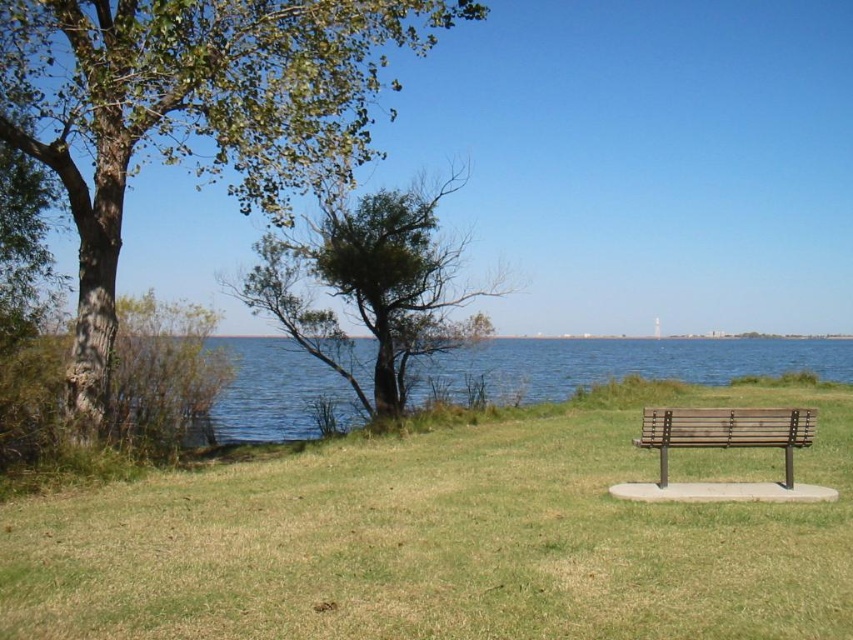
Is green grass at center shorter than green leafy tree at left?

Yes, green grass at center is shorter than green leafy tree at left.

Is green grass at center smaller than green leafy tree at left?

Indeed, green grass at center has a smaller size compared to green leafy tree at left.

The image size is (853, 640). Describe the element at coordinates (440, 541) in the screenshot. I see `green grass at center` at that location.

The image size is (853, 640). Identify the location of green grass at center. (440, 541).

Describe the element at coordinates (440, 541) in the screenshot. This screenshot has height=640, width=853. I see `green grass at center` at that location.

Is green grass at center to the left of green leafy tree at center from the viewer's perspective?

In fact, green grass at center is to the right of green leafy tree at center.

This screenshot has height=640, width=853. I want to click on green grass at center, so click(x=440, y=541).

Is point (753, 474) positioned before point (781, 426)?

No, it is behind (781, 426).

The width and height of the screenshot is (853, 640). Find the location of `green grass at center`. green grass at center is located at coordinates (440, 541).

Image resolution: width=853 pixels, height=640 pixels. In order to click on green grass at center in this screenshot , I will do `click(440, 541)`.